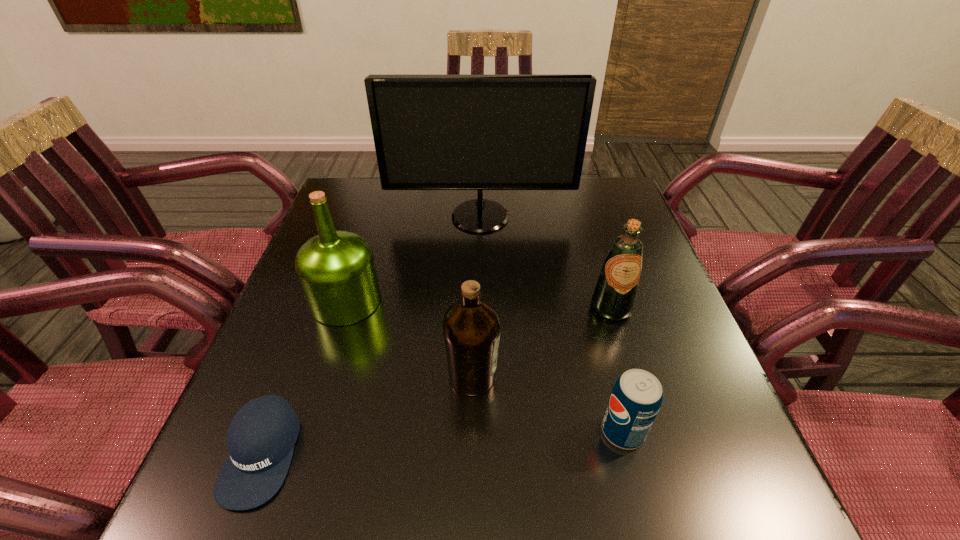
In order to click on the farthest object in this screenshot , I will do `click(431, 132)`.

Find the location of a particular element. The width and height of the screenshot is (960, 540). the tallest object is located at coordinates (431, 132).

Find the location of a particular element. This screenshot has height=540, width=960. the leftmost olive oil is located at coordinates (336, 270).

Image resolution: width=960 pixels, height=540 pixels. In order to click on the third nearest object in this screenshot , I will do `click(471, 327)`.

Find the location of a particular element. The width and height of the screenshot is (960, 540). the second olive oil from left to right is located at coordinates tap(471, 327).

Locate an element on the screen. the rightmost olive oil is located at coordinates (614, 296).

You are a GUI agent. You are given a task and a screenshot of the screen. Output one action in this format:
    pyautogui.click(x=<x>, y=<y>)
    Task: Click on the pop
    
    Given the screenshot: What is the action you would take?
    pyautogui.click(x=636, y=398)

You are a GUI agent. You are given a task and a screenshot of the screen. Output one action in this format:
    pyautogui.click(x=<x>, y=<y>)
    Task: Click on the shortest object
    
    Given the screenshot: What is the action you would take?
    pyautogui.click(x=260, y=440)

This screenshot has width=960, height=540. I want to click on free location located 0.090m on the front-facing side of the computer monitor, so click(480, 255).

Where is `free spot located 0.130m on the front of the leftmost olive oil`? The image size is (960, 540). free spot located 0.130m on the front of the leftmost olive oil is located at coordinates [x=322, y=377].